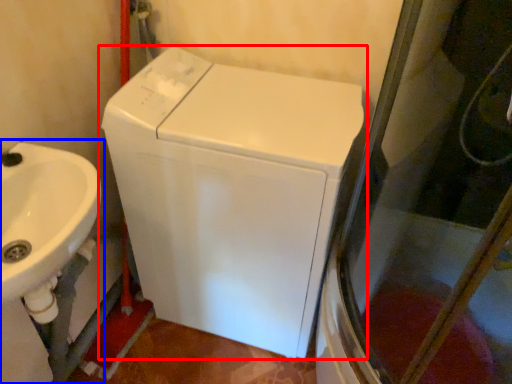
Question: Which object is further to the camera taking this photo, washing machine (highlighted by a red box) or sink (highlighted by a blue box)?

Choices:
 (A) washing machine
 (B) sink

Answer: (A)